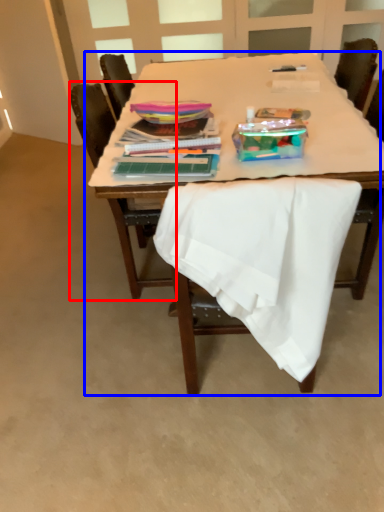
Question: Which object appears farthest to the camera in this image, chair (highlighted by a red box) or table (highlighted by a blue box)?

Choices:
 (A) chair
 (B) table

Answer: (A)